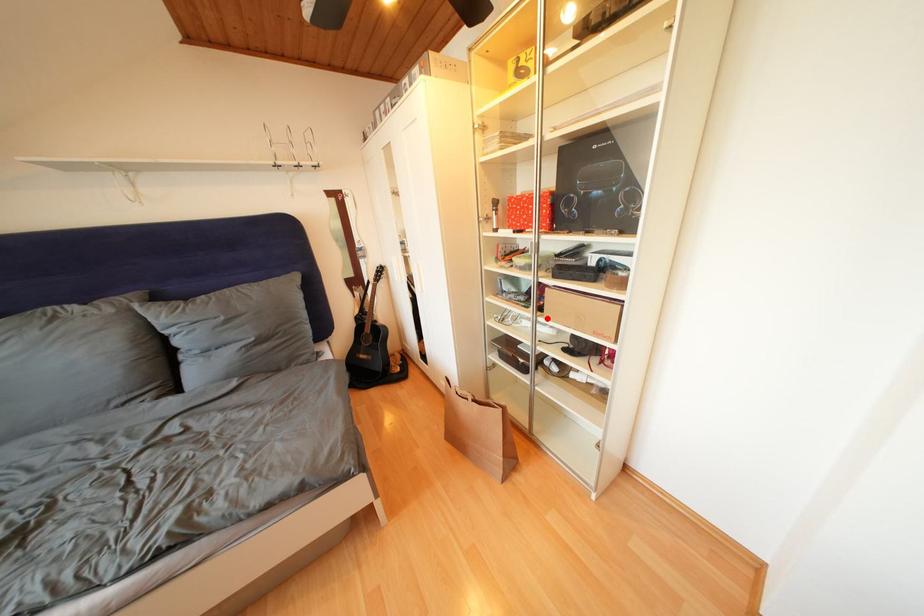
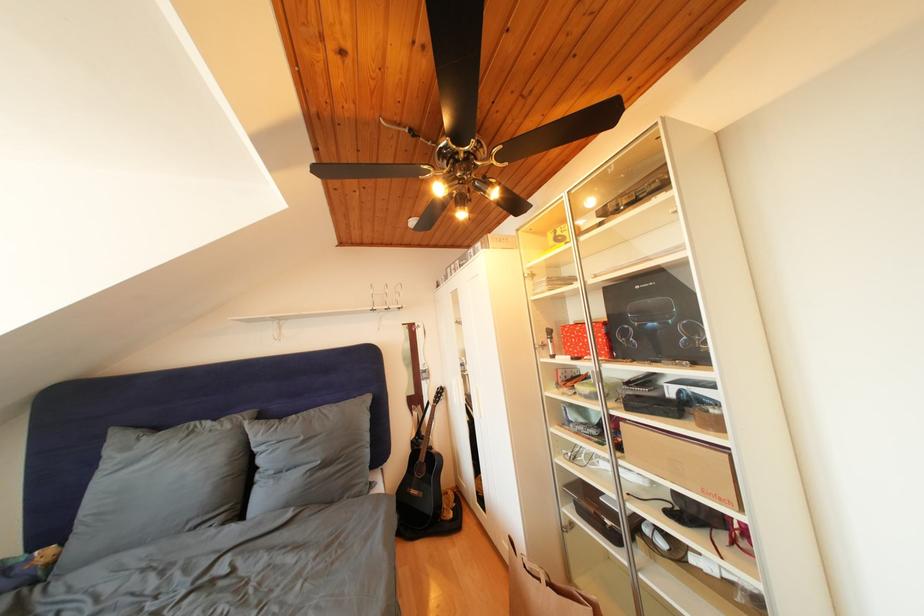
Where in the second image is the point corresponding to the highlighted location from the first image?

(626, 459)